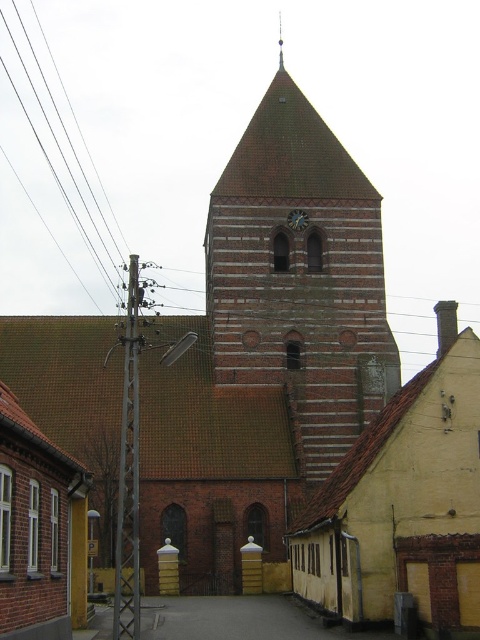
You are a tourist standing in front of the historic church. You notice a metallic gray pole at left and a brown brick tower at center. Which object is closer to your left side?

The metallic gray pole at left is closer to your left side because it is positioned to the left of the brown brick tower at center.

You are standing in front of the historic church and need to locate both the metallic gray pole at left and the matte brown clock at center. From your current position, which object is positioned to the left of the other?

The metallic gray pole at left is to the left of the matte brown clock at center, so the metallic gray pole at left is positioned to the left of the matte brown clock at center.

You are standing at the entrance of the historic church and want to take a photo of the brown brick tower at center. If your camera has a maximum zoom range of 100 feet, can you capture the entire tower without moving closer?

The brown brick tower at center is 216.09 feet away from the viewer. Since the camera can only zoom up to 100 feet, it cannot capture the entire tower without moving closer.